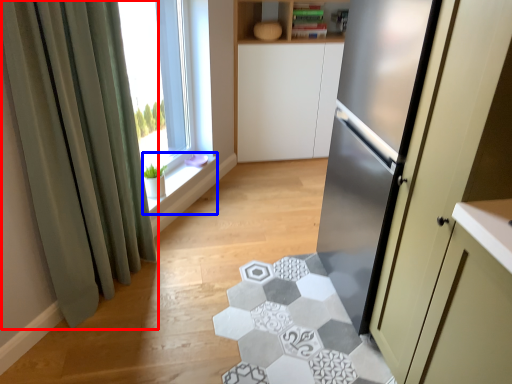
Question: Which object is closer to the camera taking this photo, curtain (highlighted by a red box) or window sill (highlighted by a blue box)?

Choices:
 (A) curtain
 (B) window sill

Answer: (A)